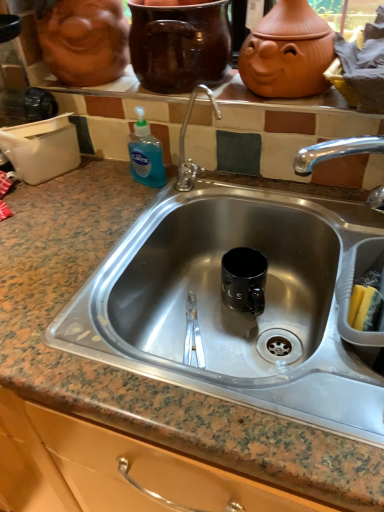
The height and width of the screenshot is (512, 384). I want to click on glossy ceramic mug at upper center, so click(x=179, y=45).

I want to click on matte ceramic face at upper left, so click(x=83, y=40).

The image size is (384, 512). I want to click on face that is above the glossy ceramic mug at upper center (from the image's perspective), so click(83, 40).

Do you think matte ceramic face at upper left is within glossy ceramic mug at upper center, or outside of it?

matte ceramic face at upper left is spatially situated outside glossy ceramic mug at upper center.

How far apart are matte ceramic face at upper left and glossy ceramic mug at upper center?

matte ceramic face at upper left and glossy ceramic mug at upper center are 14.61 centimeters apart from each other.

Which is further, (x=55, y=36) or (x=159, y=56)?

→ Point (x=55, y=36)

Is matte ceramic pots at upper center taller or shorter than marble granite sink at center?

Considering their sizes, matte ceramic pots at upper center has less height than marble granite sink at center.

Where is `countertop in front of the matte ceramic pots at upper center`? The image size is (384, 512). countertop in front of the matte ceramic pots at upper center is located at coordinates (140, 376).

In order to click on pottery above the matte ceramic pots at upper center (from a real-world perspective) in this screenshot , I will do `click(179, 45)`.

What's the angular difference between matte ceramic pots at upper center and glossy ceramic mug at upper center's facing directions?

The angular difference between matte ceramic pots at upper center and glossy ceramic mug at upper center is 1.47 degrees.

Is matte ceramic pots at upper center further to the viewer compared to glossy ceramic mug at upper center?

That is True.

Is point (232, 75) closer or farther from the camera than point (54, 51)?

Point (232, 75) appears to be farther away from the viewer than point (54, 51).

Identify the location of window sill located underneath the matte ceramic face at upper left (from a real-world perspective). (282, 99).

Considering the sizes of objects matte ceramic pots at upper center and matte ceramic face at upper left in the image provided, who is thinner, matte ceramic pots at upper center or matte ceramic face at upper left?

matte ceramic pots at upper center.

Which is in front, point (173, 42) or point (80, 94)?

Point (173, 42)

From the image's perspective, which is below, glossy ceramic mug at upper center or matte ceramic pots at upper center?

matte ceramic pots at upper center, from the image's perspective.

Does glossy ceramic mug at upper center have a smaller size compared to matte ceramic pots at upper center?

Actually, glossy ceramic mug at upper center might be larger than matte ceramic pots at upper center.

Is glossy ceramic mug at upper center facing towards marble granite sink at center?

No, glossy ceramic mug at upper center is not turned towards marble granite sink at center.

Who is taller, glossy ceramic mug at upper center or marble granite sink at center?

marble granite sink at center is taller.

Is glossy ceramic mug at upper center to the left of marble granite sink at center from the viewer's perspective?

Indeed, glossy ceramic mug at upper center is positioned on the left side of marble granite sink at center.

Does marble granite sink at center have a lesser width compared to glossy ceramic mug at upper center?

In fact, marble granite sink at center might be wider than glossy ceramic mug at upper center.

Between marble granite sink at center and glossy ceramic mug at upper center, which one has more height?

Standing taller between the two is marble granite sink at center.

The image size is (384, 512). I want to click on pottery located behind the marble granite sink at center, so click(179, 45).

Based on the photo, what's the angular difference between marble granite sink at center and glossy ceramic mug at upper center's facing directions?

There is a 0.461-degree angle between the facing directions of marble granite sink at center and glossy ceramic mug at upper center.

This screenshot has height=512, width=384. In order to click on pottery lying in front of the matte ceramic face at upper left in this screenshot , I will do `click(179, 45)`.

At what (x,y) coordinates should I click in order to perform the action: click on countertop below the matte ceramic pots at upper center (from a real-world perspective). Please return your answer as a coordinate pair (x, y). The image size is (384, 512). Looking at the image, I should click on (140, 376).

Considering their positions, is matte ceramic pots at upper center positioned closer to matte ceramic face at upper left than marble granite sink at center?

matte ceramic pots at upper center.

Based on the photo, when comparing their distances from matte ceramic face at upper left, does matte ceramic pots at upper center or glossy ceramic mug at upper center seem closer?

Among the two, matte ceramic pots at upper center is located nearer to matte ceramic face at upper left.

Based on their spatial positions, is marble granite sink at center or glossy ceramic mug at upper center further from matte ceramic face at upper left?

The object further to matte ceramic face at upper left is marble granite sink at center.

Estimate the real-world distances between objects in this image. Which object is closer to glossy ceramic mug at upper center, marble granite sink at center or matte ceramic pots at upper center?

Among the two, matte ceramic pots at upper center is located nearer to glossy ceramic mug at upper center.

From the picture: Looking at the image, which one is located closer to matte ceramic face at upper left, glossy ceramic mug at upper center or matte ceramic pots at upper center?

matte ceramic pots at upper center lies closer to matte ceramic face at upper left than the other object.

Estimate the real-world distances between objects in this image. Which object is further from glossy ceramic mug at upper center, matte ceramic pots at upper center or matte ceramic face at upper left?

matte ceramic face at upper left lies further to glossy ceramic mug at upper center than the other object.

When comparing their distances from matte ceramic pots at upper center, does marble granite sink at center or glossy ceramic mug at upper center seem closer?

glossy ceramic mug at upper center lies closer to matte ceramic pots at upper center than the other object.

Estimate the real-world distances between objects in this image. Which object is further from matte ceramic pots at upper center, matte ceramic face at upper left or glossy ceramic mug at upper center?

matte ceramic face at upper left lies further to matte ceramic pots at upper center than the other object.

Where is `pottery between matte ceramic face at upper left and matte ceramic pots at upper center`? Image resolution: width=384 pixels, height=512 pixels. pottery between matte ceramic face at upper left and matte ceramic pots at upper center is located at coordinates (179, 45).

This screenshot has width=384, height=512. I want to click on pottery between matte ceramic face at upper left and marble granite sink at center vertically, so click(x=179, y=45).

You are a GUI agent. You are given a task and a screenshot of the screen. Output one action in this format:
    pyautogui.click(x=<x>, y=<y>)
    Task: Click on the window sill between matte ceramic face at upper left and marble granite sink at center in the up-down direction
    
    Given the screenshot: What is the action you would take?
    pyautogui.click(x=282, y=99)

Identify the location of window sill between glossy ceramic mug at upper center and marble granite sink at center vertically. Image resolution: width=384 pixels, height=512 pixels. (282, 99).